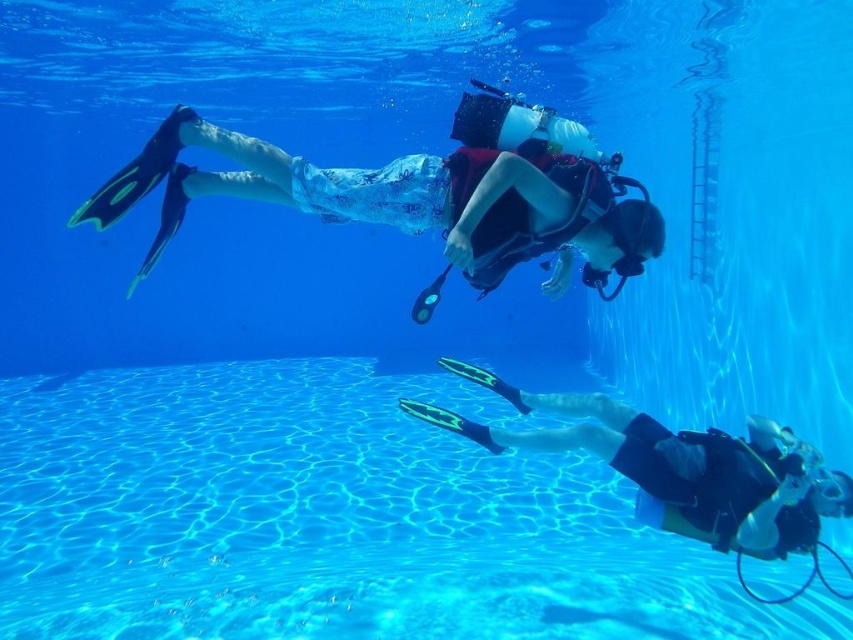
You are a scuba diver preparing to place a 1.2 meter long underwater camera on the pool floor. You see the clear blue water at lower center and the black matte fins at lower right. Which area can accommodate the camera without it extending beyond the space?

The clear blue water at lower center might be wider than black matte fins at lower right, so the camera should be placed in the clear blue water at lower center to ensure it fits within the available space.

You are a scuba diver in the pool. You need to surface to take a breath. The clear blue water at lower center is where you want to go. Which direction should you swim to reach the clear blue water at lower center from your current position at point (332, 518)?

The point (332, 518) is the location of the clear blue water at lower center, so you are already there.